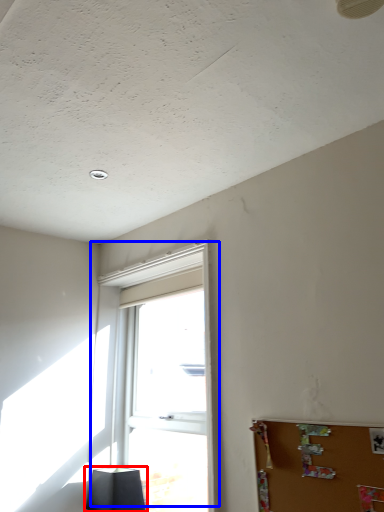
Question: Which object appears farthest to the camera in this image, lamp (highlighted by a red box) or window (highlighted by a blue box)?

Choices:
 (A) lamp
 (B) window

Answer: (A)